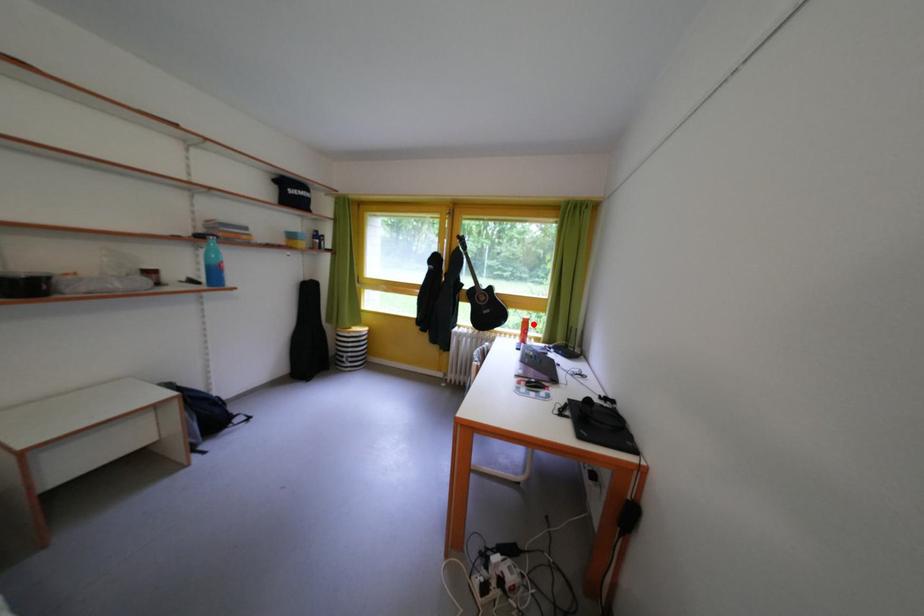
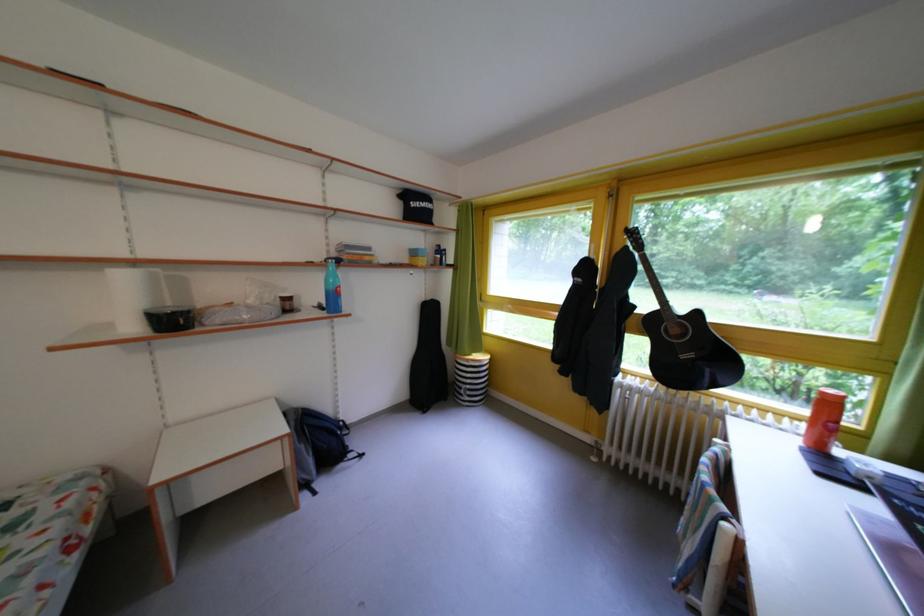
In the second image, find the point that corresponds to the highlighted location in the first image.

(833, 399)